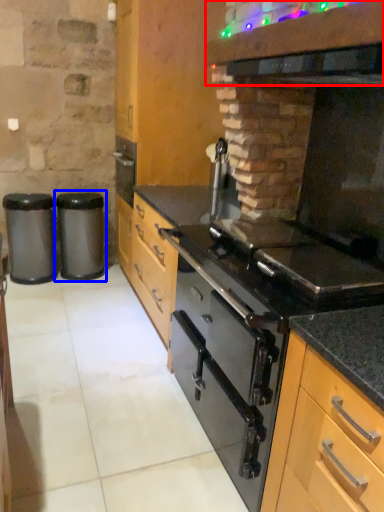
Question: Among these objects, which one is nearest to the camera, vent (highlighted by a red box) or waste container (highlighted by a blue box)?

Choices:
 (A) vent
 (B) waste container

Answer: (A)